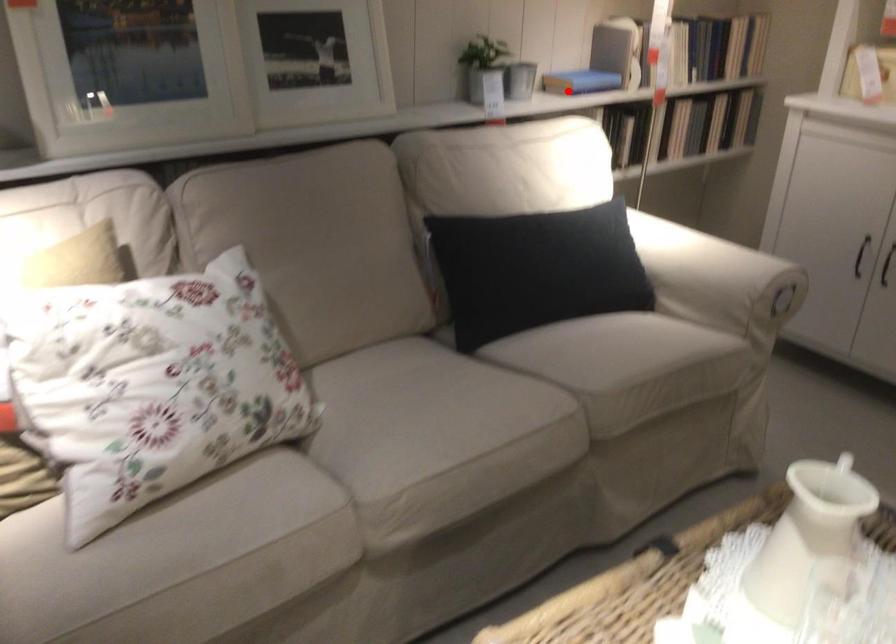
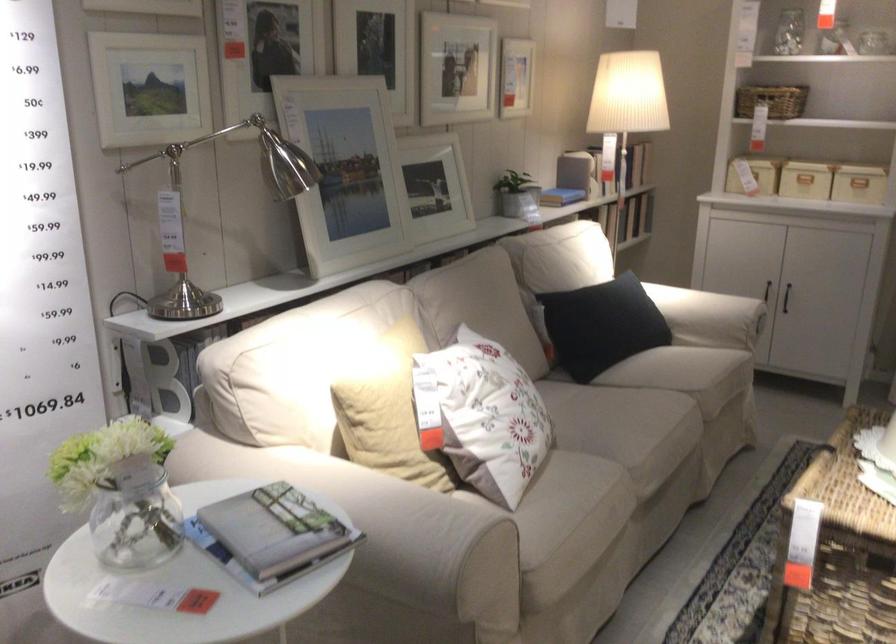
Question: I am providing you with two images of the same scene from different viewpoints. A red point is shown in image1. For the corresponding object point in image2, is it positioned nearer or farther from the camera?

Choices:
 (A) Nearer
 (B) Farther

Answer: (B)